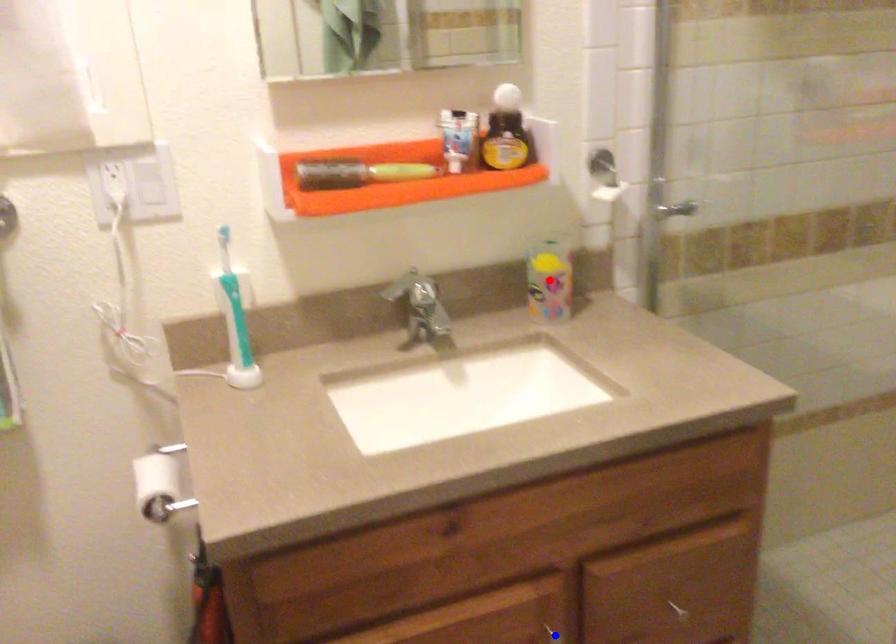
Question: In the image, two points are highlighted. Which point is nearer to the camera? Reply with the corresponding letter.

Choices:
 (A) blue point
 (B) red point

Answer: (A)